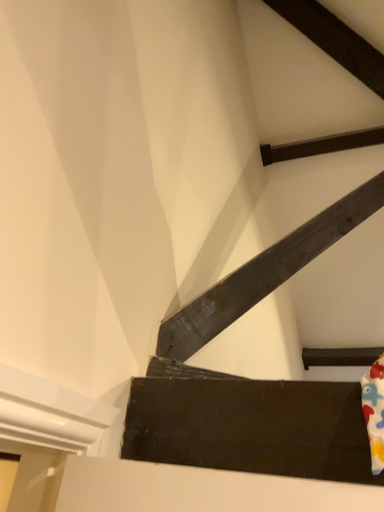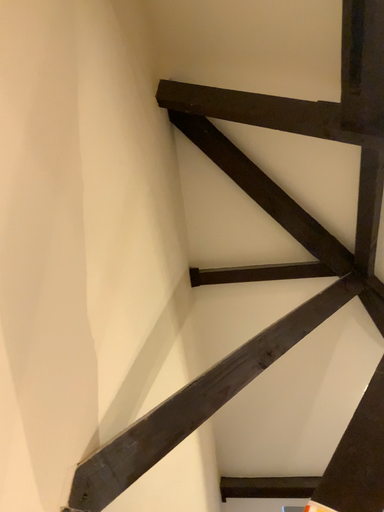
Question: Which way did the camera rotate in the video?

Choices:
 (A) rotated upward
 (B) rotated downward

Answer: (A)